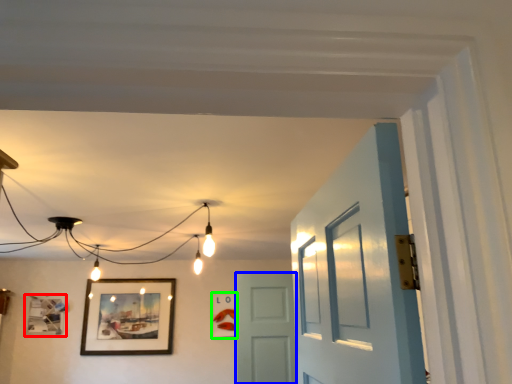
Question: Considering the real-world distances, which object is farthest from picture frame (highlighted by a red box)? door (highlighted by a blue box) or picture frame (highlighted by a green box)?

Choices:
 (A) door
 (B) picture frame

Answer: (A)